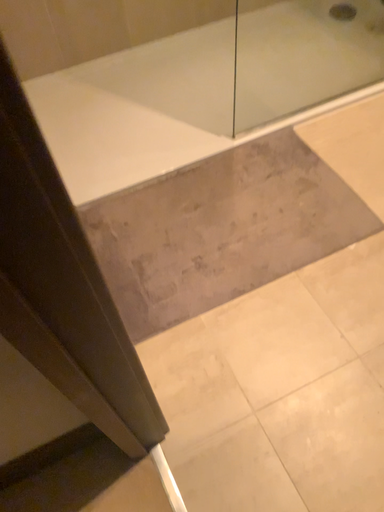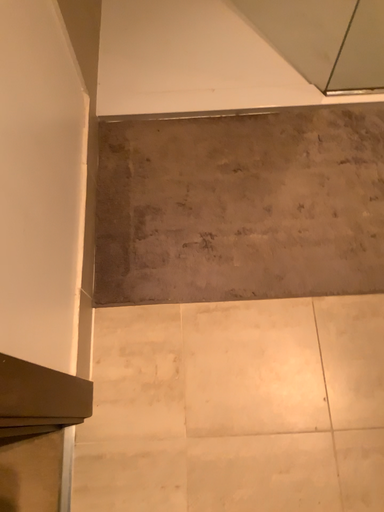
Question: Which way did the camera rotate in the video?

Choices:
 (A) rotated left
 (B) rotated right

Answer: (A)